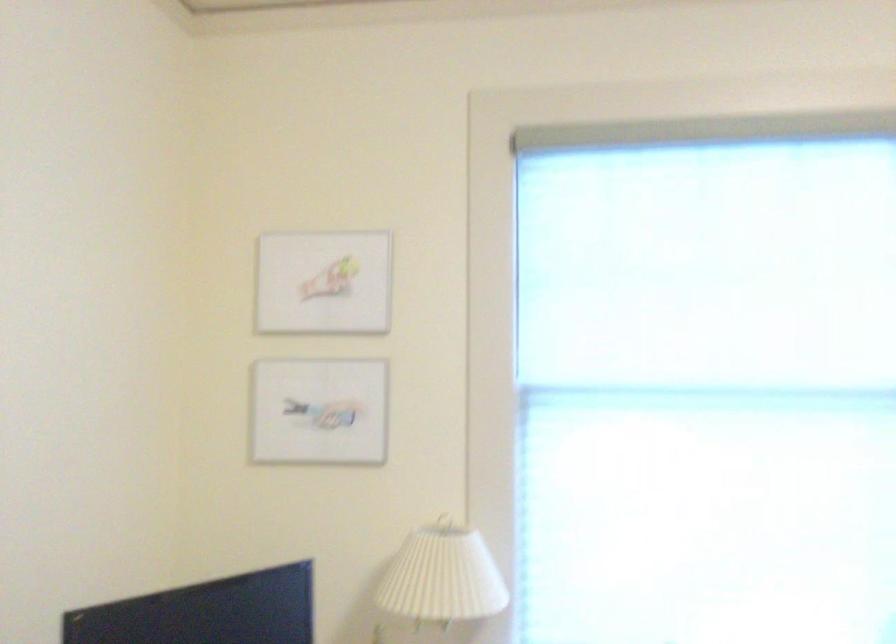
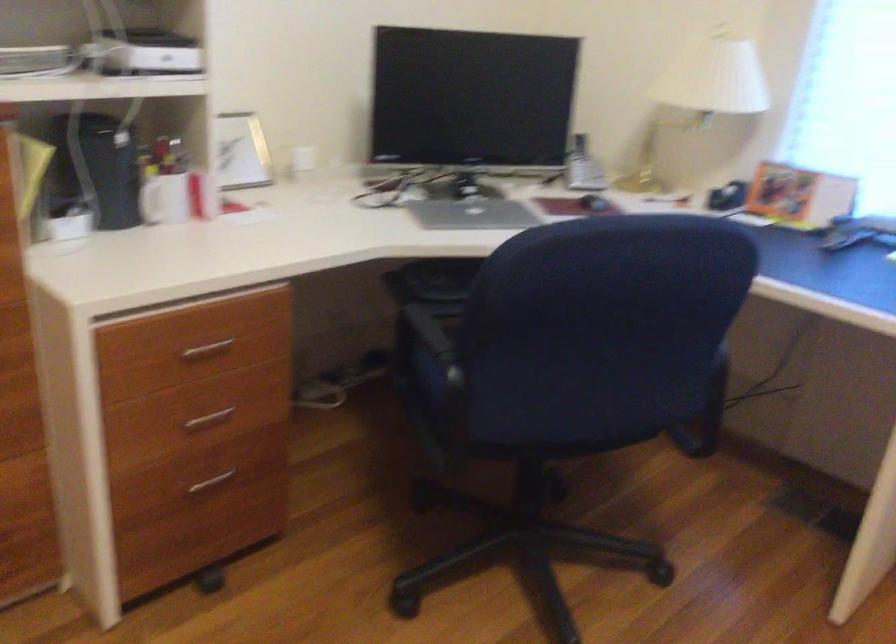
The images are taken continuously from a first-person perspective. In which direction is your viewpoint rotating?

The camera's rotation is toward left-down.